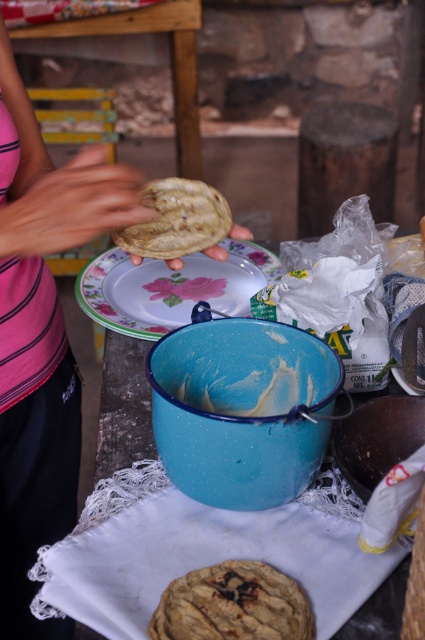
You are observing a kitchen scene where a person is preparing food. You notice two pink fabric items at the upper left corner of the image. One is labeled as the pink fabric shirt at upper left and the other is the pink fabric hand at upper left. Which of these two items is taller?

The pink fabric shirt at upper left is taller than the pink fabric hand at upper left.

You are a chef trying to place the golden textured biscuit at center onto a plate. The plate is currently under the pink fabric hand at upper left. Can you lift the biscuit and move it without moving the hand?

The pink fabric hand at upper left is larger than the golden textured biscuit at center, so you can carefully lift the biscuit and move it without needing to move the hand.